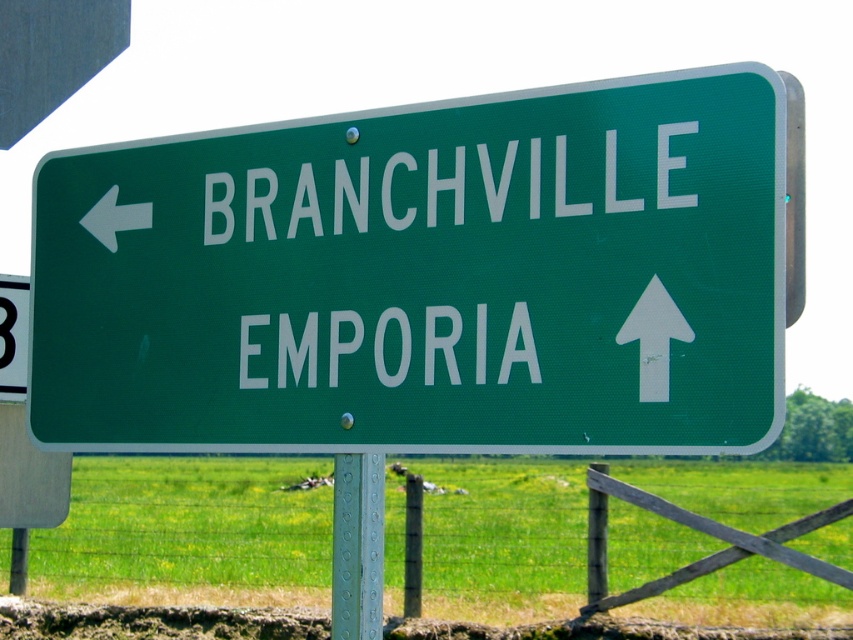
You are a delivery driver who needs to choose between two routes indicated by the arrows on the road sign. The white paper arrow at upper center points towards BRANCHVILLE, and the white matte arrow at left points towards EMPORIA. Which arrow is located lower on the sign?

The white paper arrow at upper center is positioned under the white matte arrow at left, meaning the white paper arrow at upper center is lower than the white matte arrow at left.